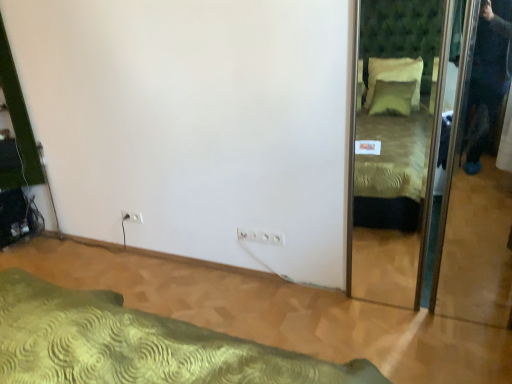
Question: Based on their positions, is white plastic electric outlet at lower left, marked as the 2th electric outlet in a right-to-left arrangement, located to the left or right of white plastic electric outlet at center, which ranks as the 1th electric outlet in right-to-left order?

Choices:
 (A) right
 (B) left

Answer: (B)

Question: From a real-world perspective, is white plastic electric outlet at lower left, arranged as the second electric outlet when viewed from the front, positioned above or below white plastic electric outlet at center, which is the second electric outlet in top-to-bottom order?

Choices:
 (A) below
 (B) above

Answer: (A)

Question: Estimate the real-world distances between objects in this image. Which object is farther from the green textured bed at lower left?

Choices:
 (A) white plastic electric outlet at center, which is the second electric outlet in top-to-bottom order
 (B) white plastic electric outlet at lower left, positioned as the 1th electric outlet in top-to-bottom order
 (C) green textured mirror at right

Answer: (C)

Question: Which of these objects is positioned closest to the white plastic electric outlet at lower left, marked as the 2th electric outlet in a bottom-to-top arrangement?

Choices:
 (A) white plastic electric outlet at center, acting as the first electric outlet starting from the front
 (B) green textured bed at lower left
 (C) green textured mirror at right

Answer: (A)